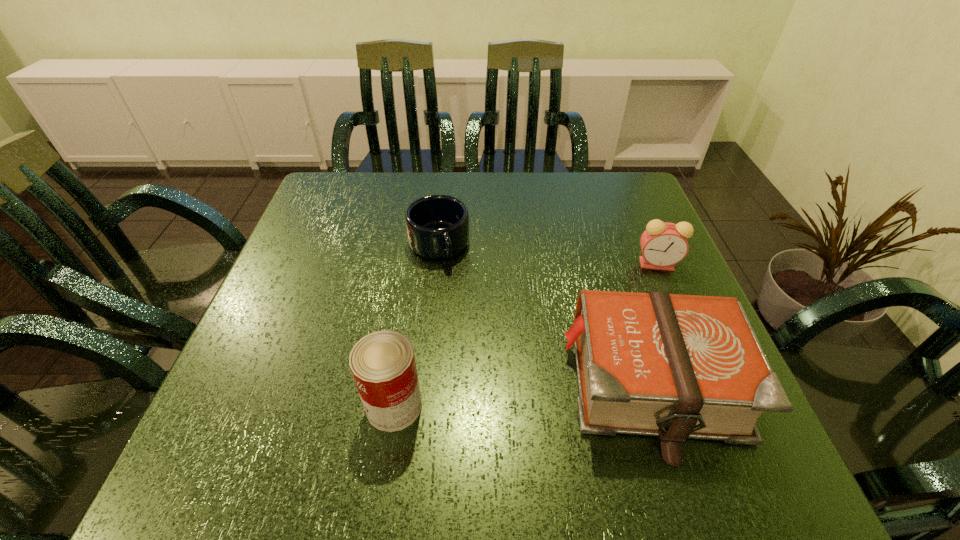
Identify the location of can. pos(382,363).

Image resolution: width=960 pixels, height=540 pixels. What are the coordinates of `Bible` in the screenshot? It's located at (674, 366).

Image resolution: width=960 pixels, height=540 pixels. I want to click on alarm clock, so click(x=663, y=244).

The image size is (960, 540). Find the location of `mug`. mug is located at coordinates (437, 226).

Identify the location of blank area located on the front label of the can. The width and height of the screenshot is (960, 540). pos(238,406).

The width and height of the screenshot is (960, 540). Find the location of `vacant space located on the front label of the can`. vacant space located on the front label of the can is located at coordinates (261, 406).

Find the location of `free region located on the front label of the can`. free region located on the front label of the can is located at coordinates (314, 406).

The width and height of the screenshot is (960, 540). I want to click on free point located on the left of the Bible, so click(411, 386).

The image size is (960, 540). What are the coordinates of `free space located 0.220m on the face of the alarm clock` in the screenshot? It's located at (581, 318).

Locate an element on the screen. The image size is (960, 540). vacant space located 0.120m on the face of the alarm clock is located at coordinates (611, 294).